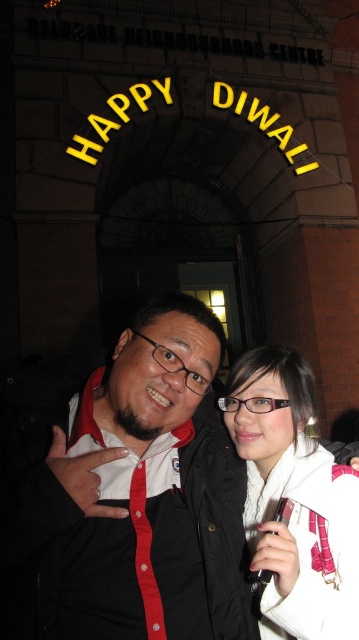
Looking at this image, you are a photographer adjusting the camera focus. You need to ensure both the matte black shirt at center and the white soft scarf at center are in focus. Given that the scarf is taller than the shirt, which object should you focus on first to ensure both are sharp?

Since the white soft scarf at center is taller than the matte black shirt at center, you should focus on the white soft scarf at center first to ensure both objects are in focus.

You are standing in front of the building entrance and want to take a photo of both the matte black shirt at center and the white soft scarf at center. Which object will appear closer to you in the photo?

The matte black shirt at center will appear closer to you in the photo because it is further to the viewer than the white soft scarf at center.